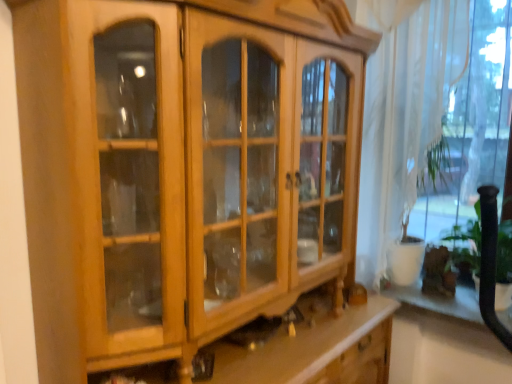
Question: From a real-world perspective, is white sheer curtain at right over white glossy shelf at lower right?

Choices:
 (A) no
 (B) yes

Answer: (B)

Question: Is white glossy shelf at lower right inside white sheer curtain at right?

Choices:
 (A) yes
 (B) no

Answer: (B)

Question: From the image's perspective, does white sheer curtain at right appear lower than white glossy shelf at lower right?

Choices:
 (A) yes
 (B) no

Answer: (B)

Question: Does white sheer curtain at right have a greater width compared to white glossy shelf at lower right?

Choices:
 (A) no
 (B) yes

Answer: (A)

Question: Can you confirm if white sheer curtain at right is smaller than white glossy shelf at lower right?

Choices:
 (A) yes
 (B) no

Answer: (B)

Question: Is white sheer curtain at right aimed at white glossy shelf at lower right?

Choices:
 (A) no
 (B) yes

Answer: (A)

Question: Is white glossy shelf at lower right smaller than white sheer curtain at right?

Choices:
 (A) yes
 (B) no

Answer: (A)

Question: Is white glossy shelf at lower right outside of white sheer curtain at right?

Choices:
 (A) yes
 (B) no

Answer: (A)

Question: Does white glossy shelf at lower right lie in front of white sheer curtain at right?

Choices:
 (A) no
 (B) yes

Answer: (A)

Question: Considering the relative sizes of white glossy shelf at lower right and white sheer curtain at right in the image provided, is white glossy shelf at lower right shorter than white sheer curtain at right?

Choices:
 (A) yes
 (B) no

Answer: (A)

Question: Is white glossy shelf at lower right oriented towards white sheer curtain at right?

Choices:
 (A) no
 (B) yes

Answer: (A)

Question: Does white glossy shelf at lower right have a greater height compared to white sheer curtain at right?

Choices:
 (A) no
 (B) yes

Answer: (A)

Question: Is white glossy shelf at lower right inside the boundaries of white sheer curtain at right, or outside?

Choices:
 (A) inside
 (B) outside

Answer: (B)